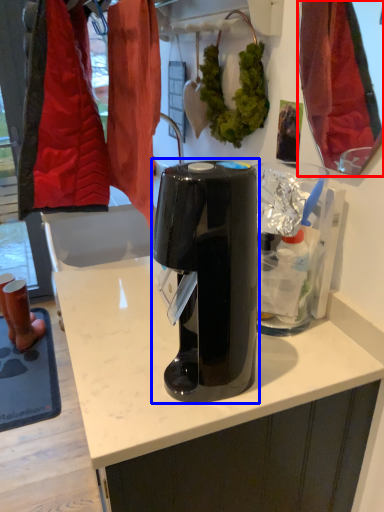
Question: Which point is closer to the camera, mirror (highlighted by a red box) or home appliance (highlighted by a blue box)?

Choices:
 (A) mirror
 (B) home appliance

Answer: (B)